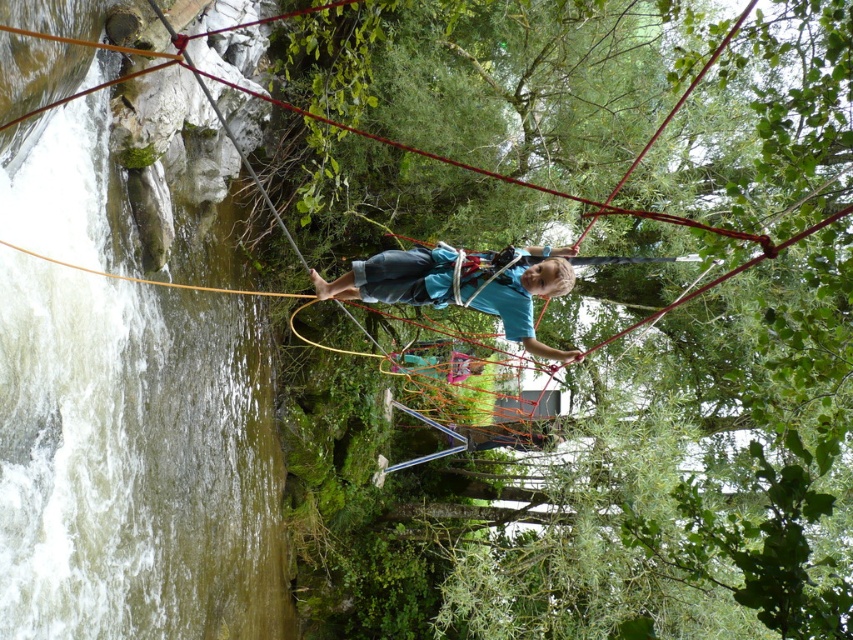
Question: Estimate the real-world distances between objects in this image. Which object is closer to the blue fabric shirt at center?

Choices:
 (A) blue fabric at center
 (B) rope bridge at center

Answer: (B)

Question: Is blue fabric shirt at center closer to camera compared to blue fabric at center?

Choices:
 (A) yes
 (B) no

Answer: (A)

Question: Is rope bridge at center closer to camera compared to blue fabric at center?

Choices:
 (A) no
 (B) yes

Answer: (B)

Question: Can you confirm if rope bridge at center is positioned below blue fabric shirt at center?

Choices:
 (A) yes
 (B) no

Answer: (B)

Question: Which object is positioned closest to the blue fabric shirt at center?

Choices:
 (A) rope bridge at center
 (B) blue fabric at center

Answer: (A)

Question: Based on their relative distances, which object is nearer to the rope bridge at center?

Choices:
 (A) blue fabric at center
 (B) blue fabric shirt at center

Answer: (A)